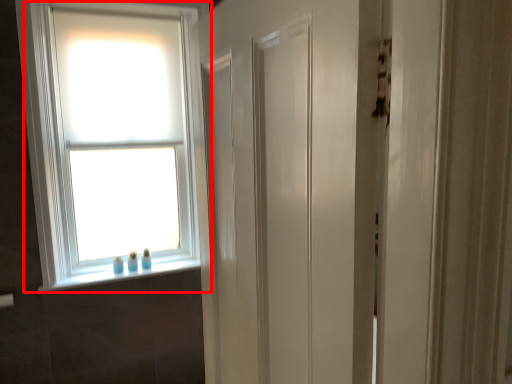
Question: From the image's perspective, where is window (annotated by the red box) located in relation to window sill in the image?

Choices:
 (A) above
 (B) below

Answer: (A)